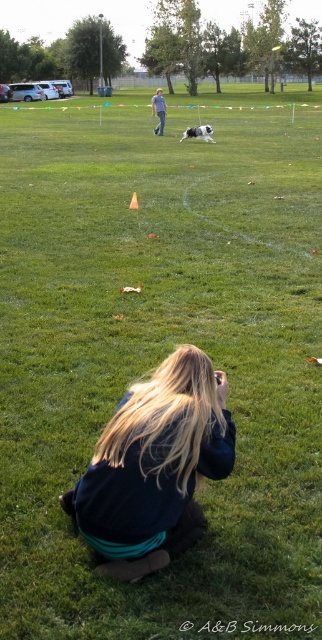
Question: Is blonde hair at lower center above blue jeans at center?

Choices:
 (A) yes
 (B) no

Answer: (B)

Question: Observing the image, what is the correct spatial positioning of blonde hair at lower center in reference to blue jeans at center?

Choices:
 (A) above
 (B) below

Answer: (B)

Question: Among these points, which one is nearest to the camera?

Choices:
 (A) (172, 525)
 (B) (154, 108)

Answer: (A)

Question: Which point is closer to the camera?

Choices:
 (A) (208, 360)
 (B) (157, 93)

Answer: (A)

Question: Is blonde hair at lower center to the left of blue jeans at center from the viewer's perspective?

Choices:
 (A) yes
 (B) no

Answer: (B)

Question: Which point is closer to the camera taking this photo?

Choices:
 (A) 161,113
 (B) 202,358

Answer: (B)